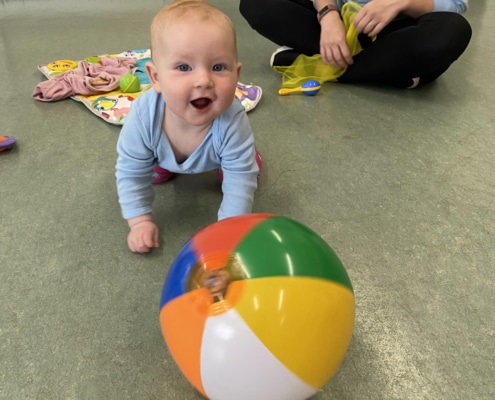
Find the location of a particular element. blanket is located at coordinates (101, 104).